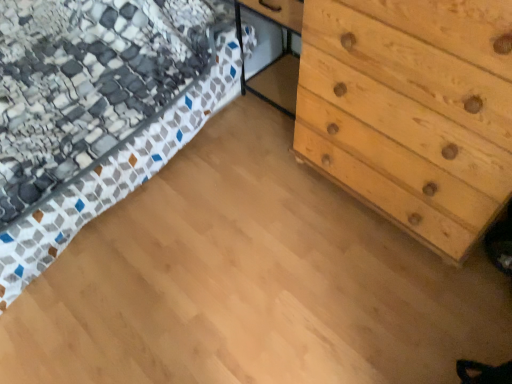
Question: Does natural wood chest of drawers at right have a greater width compared to patterned fabric bed at upper left?

Choices:
 (A) no
 (B) yes

Answer: (A)

Question: Is natural wood chest of drawers at right further to camera compared to patterned fabric bed at upper left?

Choices:
 (A) yes
 (B) no

Answer: (B)

Question: Is natural wood chest of drawers at right facing towards patterned fabric bed at upper left?

Choices:
 (A) no
 (B) yes

Answer: (A)

Question: Is natural wood chest of drawers at right not close to patterned fabric bed at upper left?

Choices:
 (A) yes
 (B) no

Answer: (B)

Question: From a real-world perspective, does natural wood chest of drawers at right sit lower than patterned fabric bed at upper left?

Choices:
 (A) no
 (B) yes

Answer: (A)

Question: Is natural wood chest of drawers at right next to patterned fabric bed at upper left?

Choices:
 (A) no
 (B) yes

Answer: (A)

Question: Is patterned fabric bed at upper left looking in the opposite direction of natural wood chest of drawers at right?

Choices:
 (A) yes
 (B) no

Answer: (B)

Question: Can you confirm if patterned fabric bed at upper left is taller than natural wood chest of drawers at right?

Choices:
 (A) no
 (B) yes

Answer: (A)

Question: Is patterned fabric bed at upper left behind natural wood chest of drawers at right?

Choices:
 (A) no
 (B) yes

Answer: (B)

Question: Does patterned fabric bed at upper left have a lesser width compared to natural wood chest of drawers at right?

Choices:
 (A) no
 (B) yes

Answer: (A)

Question: Can you confirm if patterned fabric bed at upper left is smaller than natural wood chest of drawers at right?

Choices:
 (A) yes
 (B) no

Answer: (B)

Question: Is patterned fabric bed at upper left placed right next to natural wood chest of drawers at right?

Choices:
 (A) yes
 (B) no

Answer: (B)

Question: In terms of height, does patterned fabric bed at upper left look taller or shorter compared to natural wood chest of drawers at right?

Choices:
 (A) short
 (B) tall

Answer: (A)